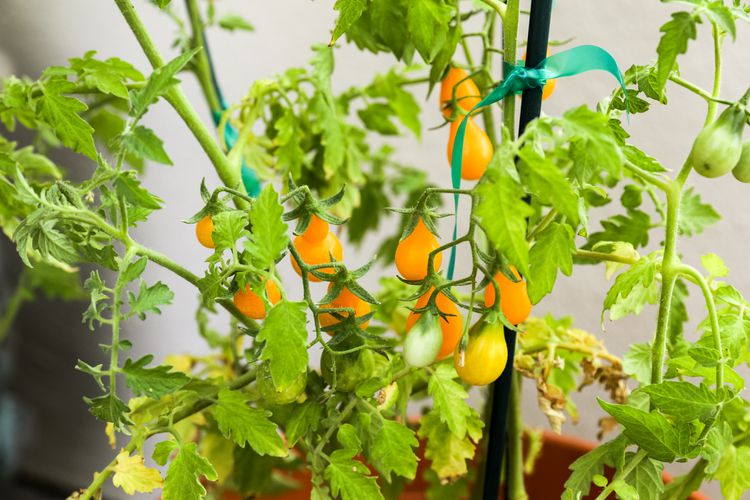
This screenshot has height=500, width=750. In order to click on shriveled plant leaves in this screenshot , I will do `click(610, 386)`, `click(546, 404)`.